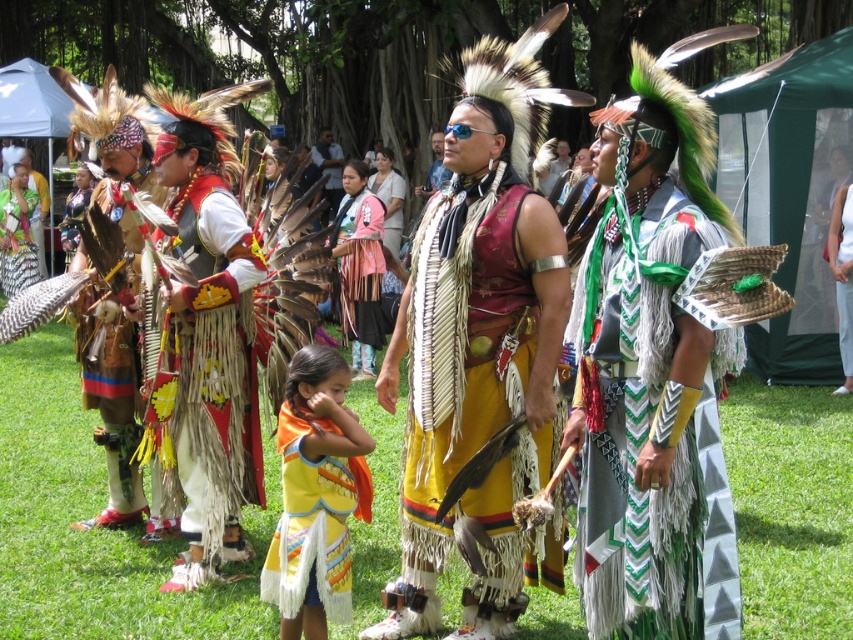
Between yellow fringed skirt at center and matte black feather at center, which one has more height?

Standing taller between the two is yellow fringed skirt at center.

Is yellow fringed skirt at center shorter than matte black feather at center?

No, yellow fringed skirt at center is not shorter than matte black feather at center.

This screenshot has height=640, width=853. In order to click on yellow fringed skirt at center in this screenshot , I will do `click(465, 348)`.

Is yellow fringed vest at center behind white cotton dress at center?

No, yellow fringed vest at center is closer to the viewer.

Does point (233, 205) lie behind point (836, 246)?

No, (233, 205) is in front of (836, 246).

Identify the location of yellow fringed vest at center. This screenshot has width=853, height=640. tap(213, 355).

I want to click on matte pink fabric dress at center, so click(x=358, y=266).

Between point (364, 289) and point (33, 264), which one is positioned in front?

Positioned in front is point (364, 289).

Between point (376, 204) and point (4, 248), which one is positioned behind?

The point (4, 248) is behind.

Locate an element on the screen. matte pink fabric dress at center is located at coordinates (358, 266).